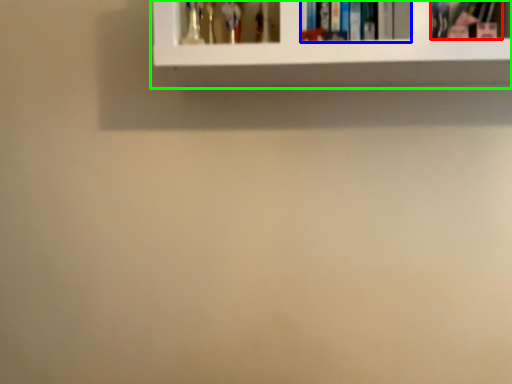
Question: Based on their relative distances, which object is farther from book (highlighted by a red box)? Choose from book (highlighted by a blue box) and shelf (highlighted by a green box).

Choices:
 (A) book
 (B) shelf

Answer: (B)